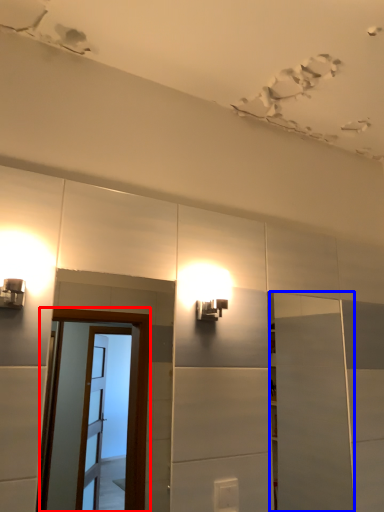
Question: Which of the following is the closest to the observer, screen door (highlighted by a red box) or door (highlighted by a blue box)?

Choices:
 (A) screen door
 (B) door

Answer: (A)